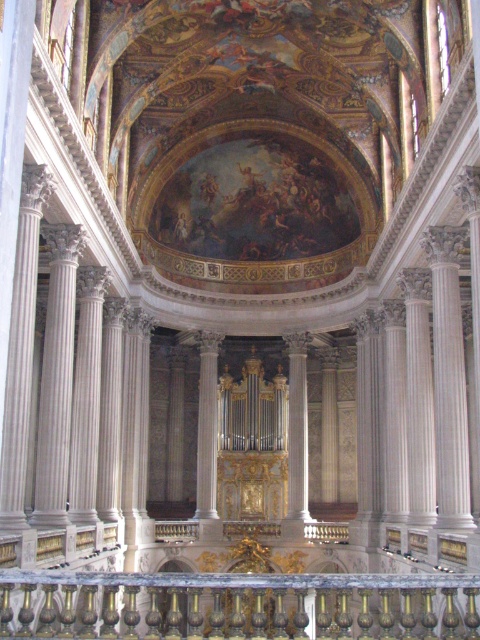
You are a tour guide leading a group through the cathedral. You want to ensure that visitors can walk from the gold polished metal railing at center to the white marble pillar at center without any obstruction. Given that the average walking path width required for a group is 1.2 meters, is the space between them sufficient?

The distance between the gold polished metal railing at center and the white marble pillar at center is 43.15 meters, which is significantly wider than the required 1.2 meters. Therefore, the space is more than sufficient for the group to walk without obstruction.

You are standing in the grand cathedral and want to find the gold polished metal railing at center. Based on its 2D coordinates, which area of the cathedral should you look towards?

The gold polished metal railing at center is located at the coordinates point (238, 605), so you should look towards the center area of the cathedral.